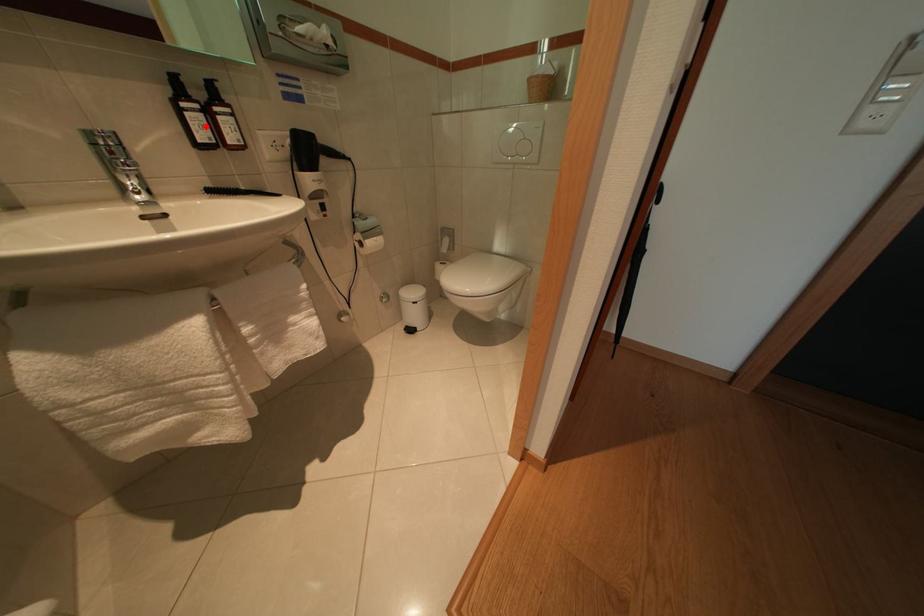
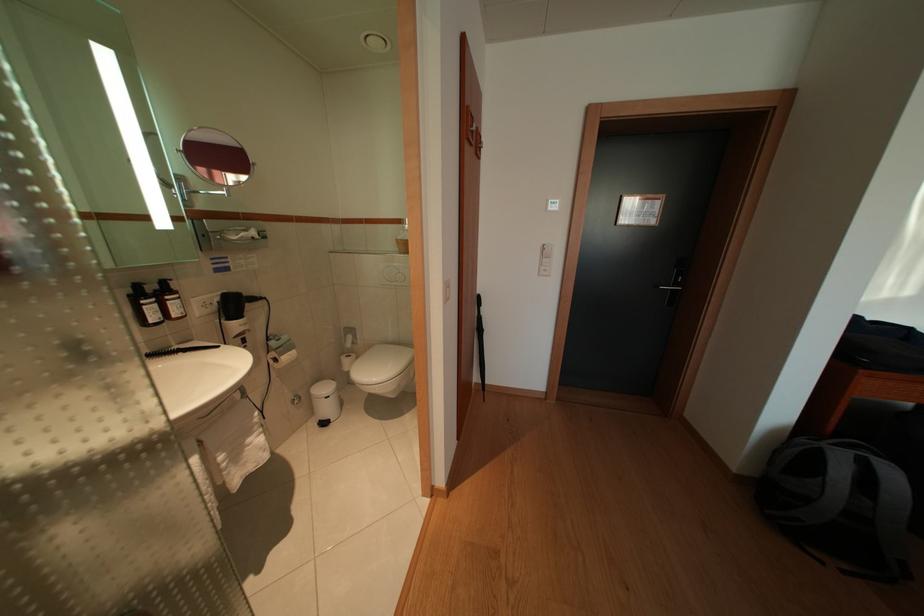
Question: I am providing you with two images of the same scene from different viewpoints. A red point is marked on the first image. At the location where the point appears in image 1, is it still visible in image 2?

Choices:
 (A) Yes
 (B) No

Answer: (A)